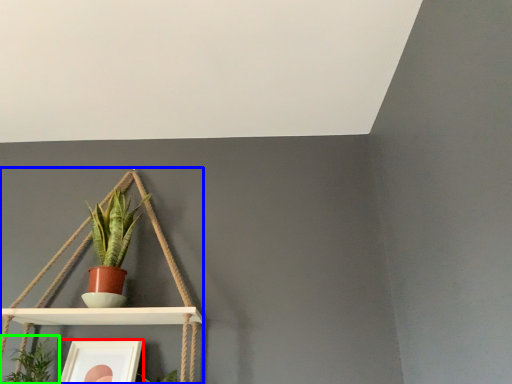
Question: Which object is positioned farthest from picture frame (highlighted by a red box)? Select from shelf (highlighted by a blue box) and houseplant (highlighted by a green box).

Choices:
 (A) shelf
 (B) houseplant

Answer: (A)